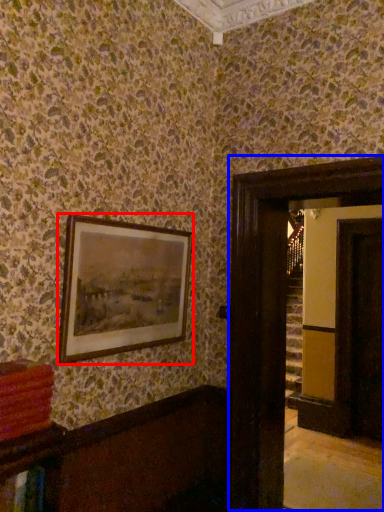
Question: Which point is closer to the camera, picture frame (highlighted by a red box) or glass door (highlighted by a blue box)?

Choices:
 (A) picture frame
 (B) glass door

Answer: (A)